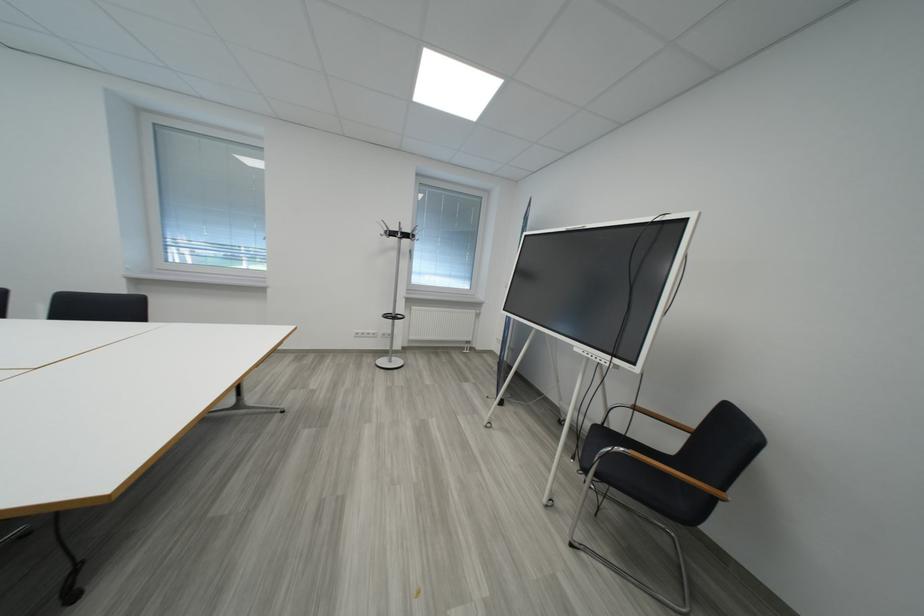
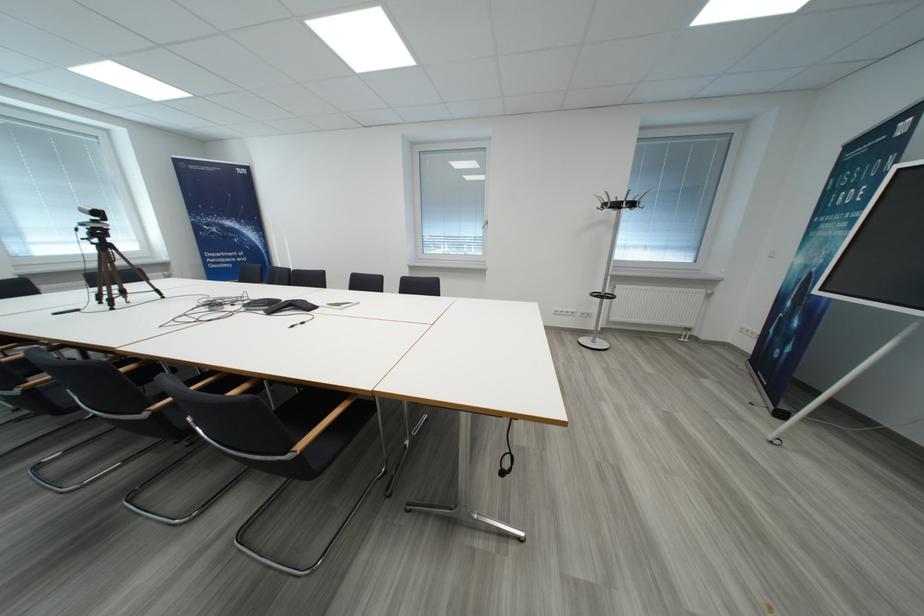
Where in the second image is the point corresponding to [399,237] from the first image?

(623, 208)